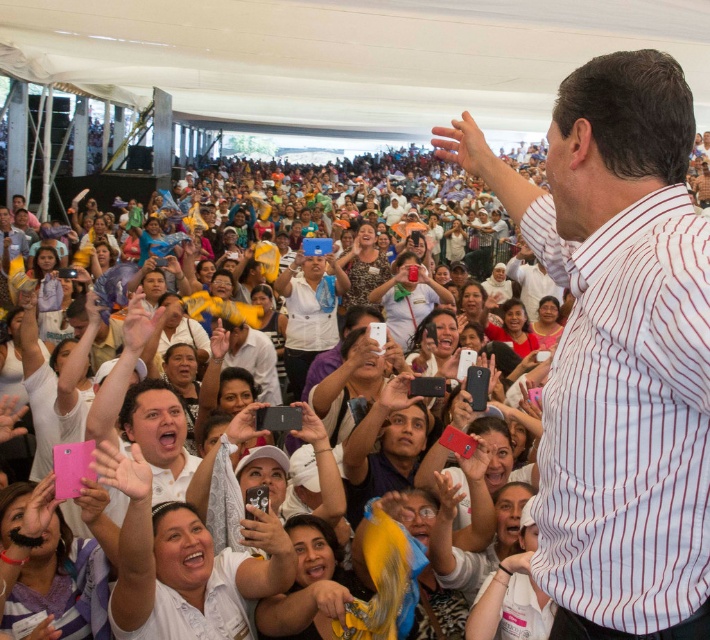
Question: Among these objects, which one is farthest from the camera?

Choices:
 (A) white striped shirt at upper right
 (B) white striped shirt at center
 (C) white matte shirt at center

Answer: (C)

Question: Is white striped shirt at center thinner than white striped shirt at upper right?

Choices:
 (A) no
 (B) yes

Answer: (B)

Question: Which object appears farthest from the camera in this image?

Choices:
 (A) white striped shirt at upper right
 (B) white striped shirt at center

Answer: (A)

Question: Among these objects, which one is farthest from the camera?

Choices:
 (A) white matte shirt at center
 (B) white striped shirt at center

Answer: (A)

Question: Does white striped shirt at center appear under white striped shirt at upper right?

Choices:
 (A) yes
 (B) no

Answer: (B)

Question: Can you confirm if white striped shirt at center is positioned to the right of white matte shirt at center?

Choices:
 (A) yes
 (B) no

Answer: (A)